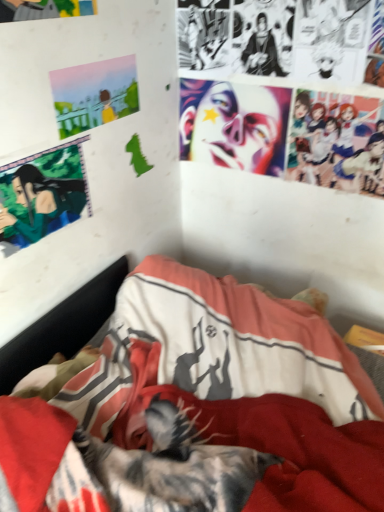
Question: Is shiny plastic face at upper center bigger or smaller than green matte anime character at upper left?

Choices:
 (A) big
 (B) small

Answer: (A)

Question: Considering the relative positions of shiny plastic face at upper center and green matte anime character at upper left in the image provided, is shiny plastic face at upper center to the left or to the right of green matte anime character at upper left?

Choices:
 (A) right
 (B) left

Answer: (A)

Question: Considering the real-world distances, which object is closest to the shiny plastic face at upper center?

Choices:
 (A) green matte anime character at upper left
 (B) textured fabric bed at center
 (C) pastel acrylic painting at upper left

Answer: (C)

Question: Which of these objects is positioned farthest from the shiny plastic face at upper center?

Choices:
 (A) pastel acrylic painting at upper left
 (B) green matte anime character at upper left
 (C) textured fabric bed at center

Answer: (C)